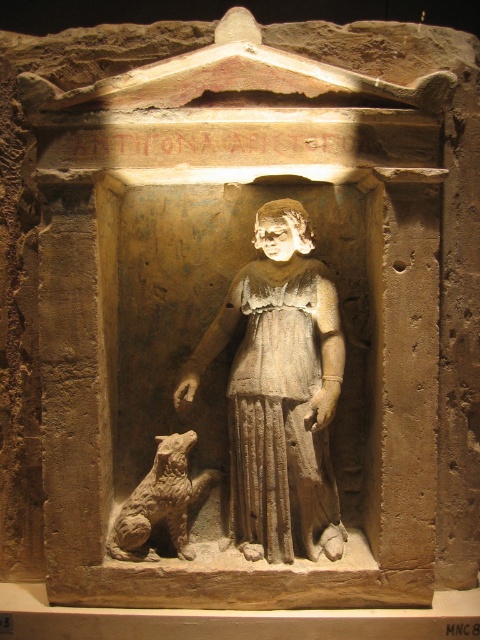
Is gray stone statue at center wider than brown textured dog at lower left?

Indeed, gray stone statue at center has a greater width compared to brown textured dog at lower left.

Who is more forward, (x=312, y=422) or (x=167, y=506)?

Positioned in front is point (x=312, y=422).

Is point (269, 477) more distant than point (167, 497)?

Yes, it is.

At what (x,y) coordinates should I click in order to perform the action: click on gray stone statue at center. Please return your answer as a coordinate pair (x, y). The height and width of the screenshot is (640, 480). Looking at the image, I should click on (278, 390).